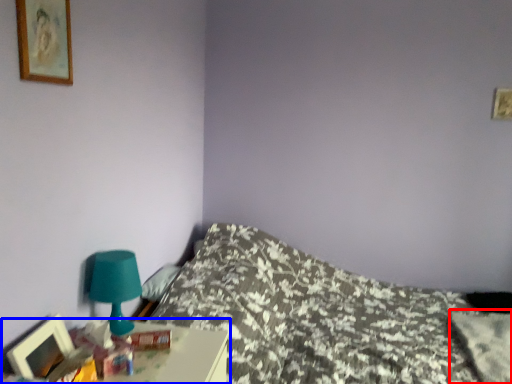
Question: Which object is further to the camera taking this photo, pillow (highlighted by a red box) or nightstand (highlighted by a blue box)?

Choices:
 (A) pillow
 (B) nightstand

Answer: (A)